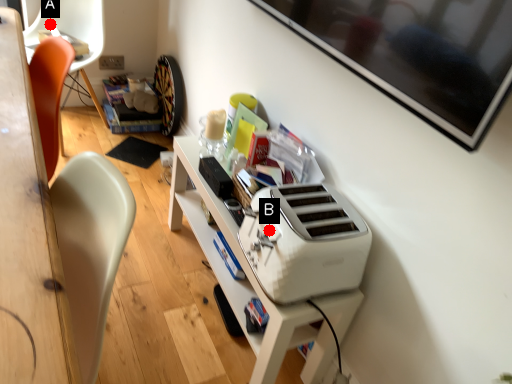
Question: Two points are circled on the image, labeled by A and B beside each circle. Which point is closer to the camera?

Choices:
 (A) A is closer
 (B) B is closer

Answer: (B)